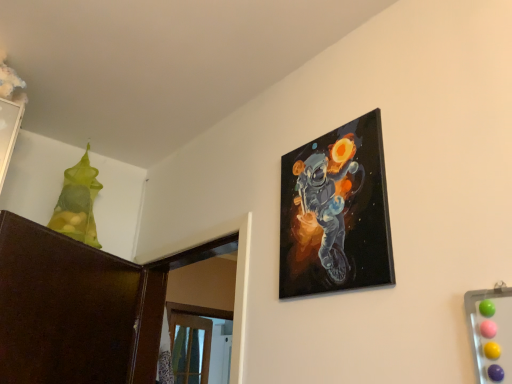
Where is `metallic painting at upper right`? metallic painting at upper right is located at coordinates (336, 213).

The image size is (512, 384). What do you see at coordinates (336, 213) in the screenshot?
I see `metallic painting at upper right` at bounding box center [336, 213].

The height and width of the screenshot is (384, 512). Identify the location of metallic painting at upper right. (336, 213).